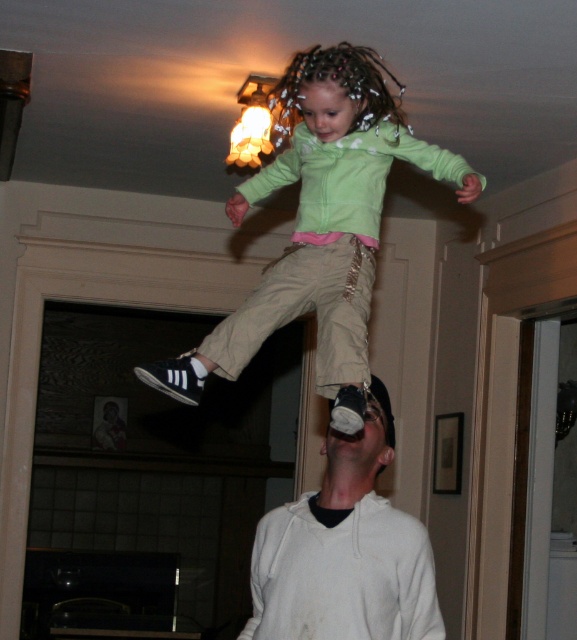
You are a photographer trying to capture a clear shot of both the green matte hoodie at upper center and the white cotton hoodie at lower center. Since you can only focus on one object at a time, which hoodie should you focus on to ensure the other is still somewhat in focus?

You should focus on the green matte hoodie at upper center because it is closer to you than the white cotton hoodie at lower center, so focusing on the closer one will keep the farther one more in focus.

You are a delivery robot that needs to pass between the green matte hoodie at upper center and the white cotton hoodie at lower center. Your width is 18 inches. Can you fit through the space between them?

The distance between the green matte hoodie at upper center and the white cotton hoodie at lower center is 21.15 inches. Since your width is 18 inches, you can fit through the space as 18 is less than 21.15.